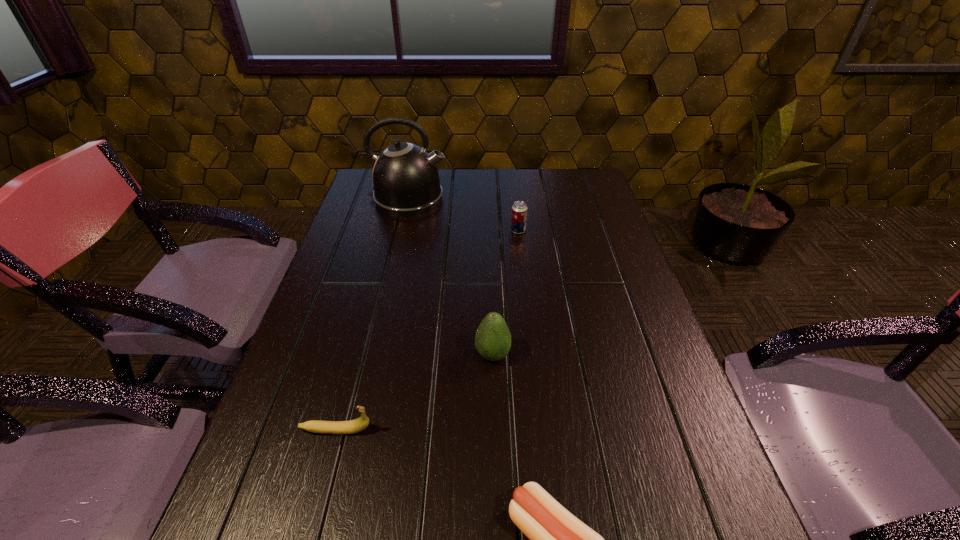
Identify the location of the tallest object. (405, 178).

The height and width of the screenshot is (540, 960). In order to click on the farthest object in this screenshot , I will do `click(405, 178)`.

Locate an element on the screen. The image size is (960, 540). the third farthest object is located at coordinates (493, 339).

Identify the location of the fourth shortest object. (493, 339).

Where is `beer can`? This screenshot has height=540, width=960. beer can is located at coordinates (519, 209).

In order to click on the second nearest object in this screenshot , I will do `click(316, 426)`.

Locate an element on the screen. vacant space located on the spout of the tallest object is located at coordinates [511, 198].

Where is `vacant region located on the back of the avocado`? vacant region located on the back of the avocado is located at coordinates (492, 319).

You are a GUI agent. You are given a task and a screenshot of the screen. Output one action in this format:
    pyautogui.click(x=<x>, y=<y>)
    Task: Click on the vacant area located on the front of the second farthest object
    This screenshot has height=540, width=960.
    Given the screenshot: What is the action you would take?
    pyautogui.click(x=525, y=287)

Locate an element on the screen. The image size is (960, 540). vacant space located 0.240m at the stem of the banana is located at coordinates point(499,430).